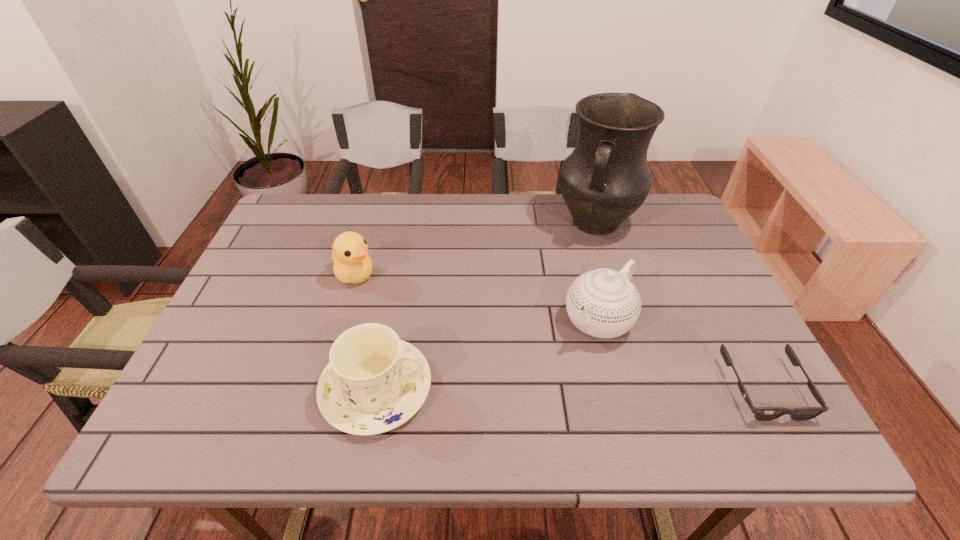
Where is `free space between the second farthest object and the pitcher`? free space between the second farthest object and the pitcher is located at coordinates (475, 249).

Locate an element on the screen. This screenshot has height=540, width=960. empty space that is in between the taller chinaware and the shorter chinaware is located at coordinates [488, 354].

What are the coordinates of `free spot between the right chinaware and the shortest object` in the screenshot? It's located at (681, 354).

This screenshot has width=960, height=540. What are the coordinates of `vacant space in between the fourth nearest object and the sunglasses` in the screenshot? It's located at (560, 332).

Locate an element on the screen. The width and height of the screenshot is (960, 540). empty space between the left chinaware and the sunglasses is located at coordinates (570, 388).

Identify the location of unoccupied area between the second farthest object and the right chinaware. The image size is (960, 540). (476, 298).

Image resolution: width=960 pixels, height=540 pixels. I want to click on free space that is in between the right chinaware and the duck, so click(x=476, y=298).

Where is `vacant point located between the tallest object and the second farthest object`? The height and width of the screenshot is (540, 960). vacant point located between the tallest object and the second farthest object is located at coordinates (475, 249).

Choose which object is the third nearest neighbor to the right chinaware. Please provide its 2D coordinates. Your answer should be formatted as a tuple, i.e. [(x, y)], where the tuple contains the x and y coordinates of a point satisfying the conditions above.

[(374, 382)]

You are a GUI agent. You are given a task and a screenshot of the screen. Output one action in this format:
    pyautogui.click(x=<x>, y=<y>)
    Task: Click on the third closest object to the left chinaware
    
    Given the screenshot: What is the action you would take?
    pyautogui.click(x=606, y=178)